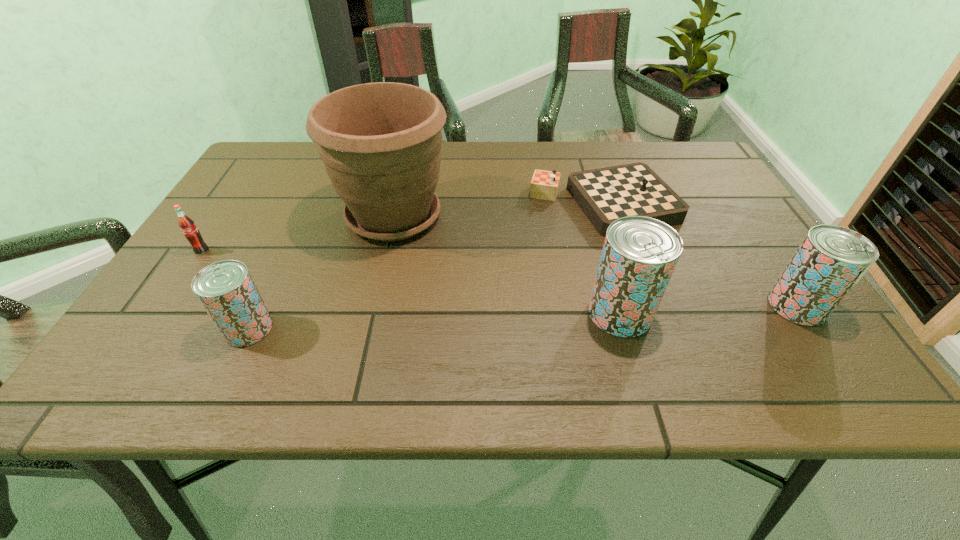
Where is `object that is at the far right corner`? object that is at the far right corner is located at coordinates (606, 194).

The height and width of the screenshot is (540, 960). In order to click on object situated at the near right corner in this screenshot , I will do (831, 259).

I want to click on free space at the far edge of the desktop, so click(615, 141).

Locate an element on the screen. Image resolution: width=960 pixels, height=540 pixels. blank space at the near edge of the desktop is located at coordinates (631, 343).

This screenshot has height=540, width=960. In the image, there is a desktop. In order to click on vacant space at the left edge in this screenshot , I will do `click(208, 259)`.

In the image, there is a desktop. Find the location of `vacant space at the right edge`. vacant space at the right edge is located at coordinates (733, 249).

What are the coordinates of `free space at the near left corner of the desktop` in the screenshot? It's located at (163, 331).

Locate an element on the screen. The width and height of the screenshot is (960, 540). vacant space at the far right corner is located at coordinates (678, 154).

Identify the location of vacant space that's between the tallest object and the rightmost object. (595, 261).

Where is `free space between the tallest object and the second object from left to right`? This screenshot has height=540, width=960. free space between the tallest object and the second object from left to right is located at coordinates (322, 272).